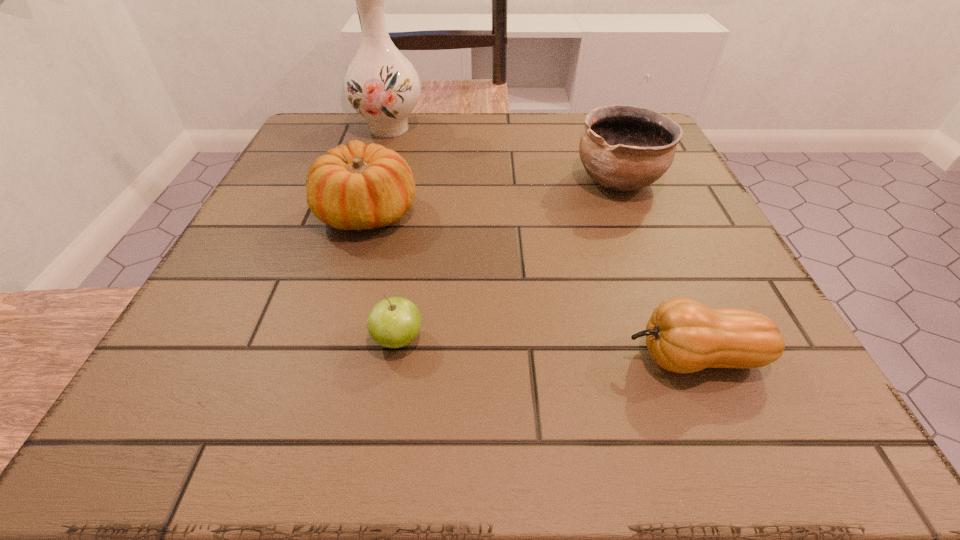
Where is `pottery located at the right edge`? pottery located at the right edge is located at coordinates [x=623, y=148].

Identify the location of gourd that is at the right edge. This screenshot has height=540, width=960. (682, 335).

The image size is (960, 540). I want to click on object that is at the far left corner, so click(x=381, y=84).

This screenshot has width=960, height=540. In order to click on object that is at the far right corner in this screenshot , I will do `click(623, 148)`.

Find the location of a particular element. This screenshot has width=960, height=540. object situated at the near right corner is located at coordinates (682, 335).

At what (x,y) coordinates should I click in order to perform the action: click on vacant area at the far edge of the desktop. Please return your answer as a coordinate pair (x, y). This screenshot has width=960, height=540. Looking at the image, I should click on tap(454, 163).

Identify the location of blank space at the near edge of the desktop. (550, 411).

In the image, there is a desktop. Identify the location of free space at the right edge. The image size is (960, 540). (706, 213).

Where is `vacant point located between the shortest object and the second shortest object`? vacant point located between the shortest object and the second shortest object is located at coordinates (546, 348).

You are a GUI agent. You are given a task and a screenshot of the screen. Output one action in this format:
    pyautogui.click(x=<x>, y=<y>)
    Task: Click on the unoccupied position between the shortest object and the pottery
    The width and height of the screenshot is (960, 540).
    Given the screenshot: What is the action you would take?
    pyautogui.click(x=509, y=260)